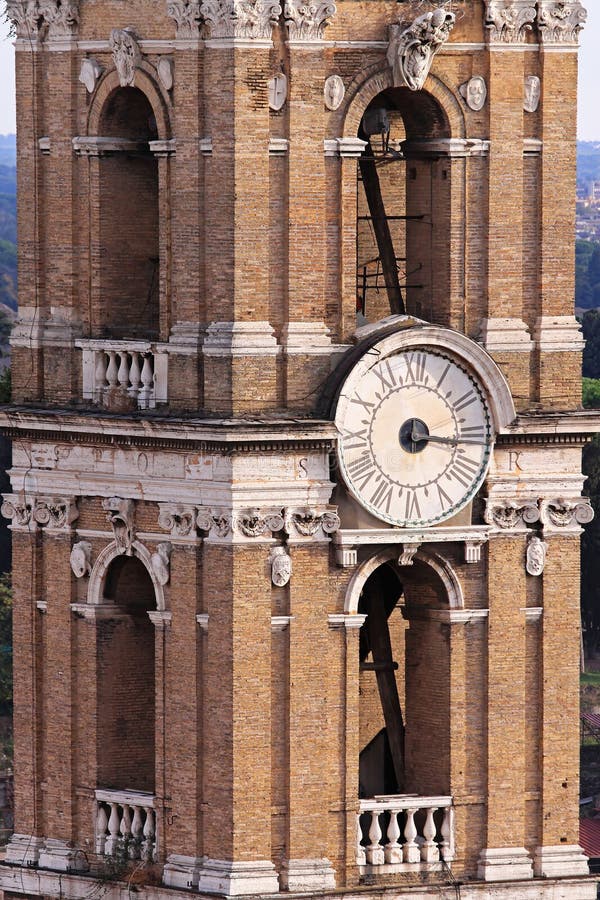
I want to click on corner, so click(231, 750).